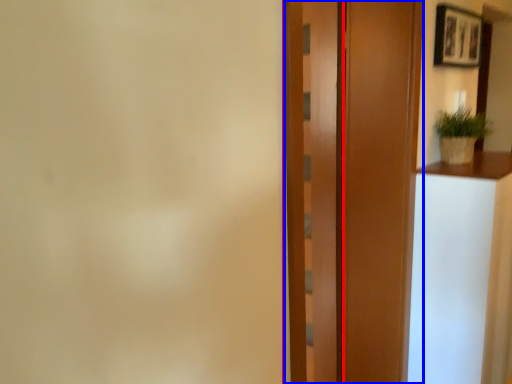
Question: Which of the following is the closest to the observer, barn door (highlighted by a red box) or door (highlighted by a blue box)?

Choices:
 (A) barn door
 (B) door

Answer: (B)